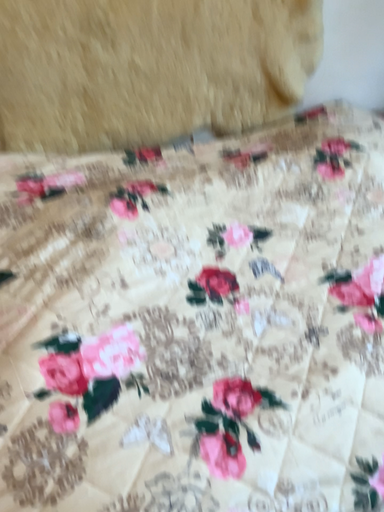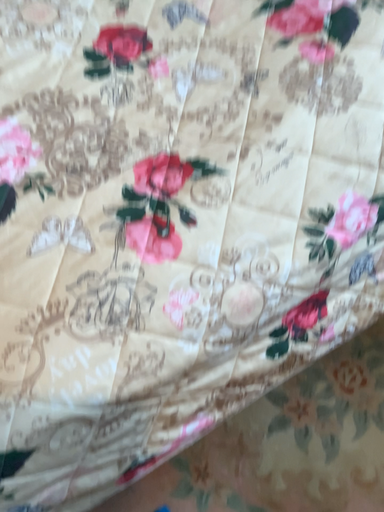
Question: Which way did the camera rotate in the video?

Choices:
 (A) rotated downward
 (B) rotated upward

Answer: (A)